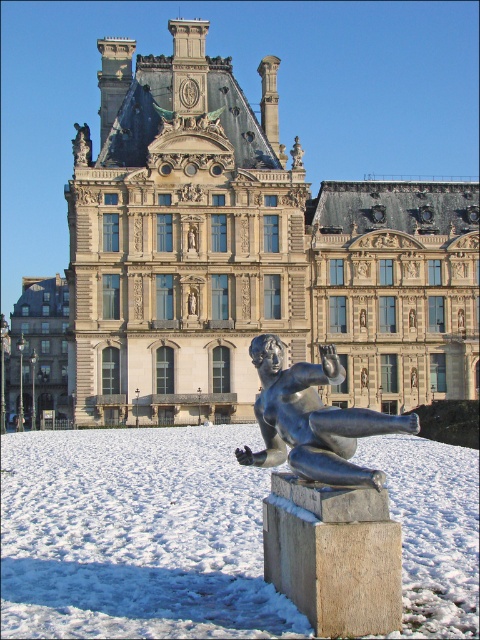
Question: Which of the following is the closest to the observer?

Choices:
 (A) white snow at center
 (B) polished bronze statue at center

Answer: (A)

Question: Is white snow at center smaller than polished bronze statue at center?

Choices:
 (A) no
 (B) yes

Answer: (B)

Question: Can you confirm if white snow at center is positioned above polished bronze statue at center?

Choices:
 (A) no
 (B) yes

Answer: (A)

Question: Which of the following is the closest to the observer?

Choices:
 (A) white snow at center
 (B) polished bronze statue at center

Answer: (A)

Question: Among these objects, which one is farthest from the camera?

Choices:
 (A) polished bronze statue at center
 (B) white snow at center

Answer: (A)

Question: Does white snow at center appear on the right side of polished bronze statue at center?

Choices:
 (A) yes
 (B) no

Answer: (B)